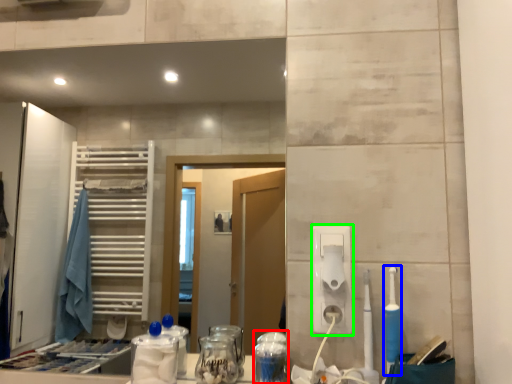
Question: Considering the real-world distances, which object is farthest from glass jar (highlighted by a red box)? toothbrush (highlighted by a blue box) or hand dryer (highlighted by a green box)?

Choices:
 (A) toothbrush
 (B) hand dryer

Answer: (A)